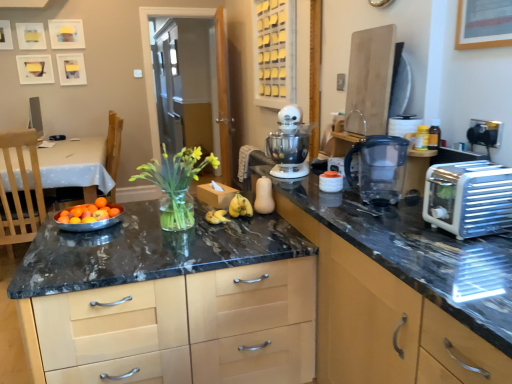
This screenshot has height=384, width=512. I want to click on vacant space in front of metallic silver bowl of mixed fruits at center-left, so click(86, 243).